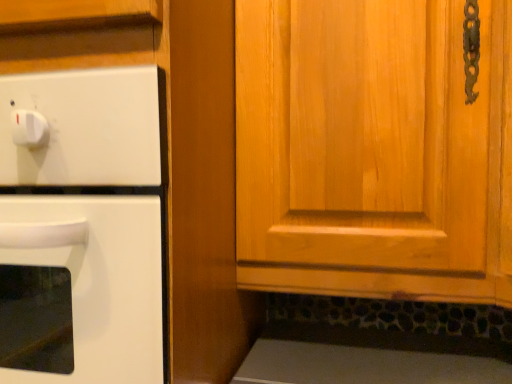
The height and width of the screenshot is (384, 512). Identify the location of white glossy oven at left. (81, 227).

Measure the distance between white glossy oven at left and camera.

white glossy oven at left is 17.34 inches away from camera.

Describe the element at coordinates (81, 227) in the screenshot. I see `white glossy oven at left` at that location.

Image resolution: width=512 pixels, height=384 pixels. I want to click on wooden cabinet at center, so click(373, 150).

Image resolution: width=512 pixels, height=384 pixels. Describe the element at coordinates (373, 150) in the screenshot. I see `wooden cabinet at center` at that location.

This screenshot has width=512, height=384. Identify the location of white glossy oven at left. (81, 227).

Does wooden cabinet at center appear on the left side of white glossy oven at left?

In fact, wooden cabinet at center is to the right of white glossy oven at left.

Does wooden cabinet at center lie behind white glossy oven at left?

No, wooden cabinet at center is closer to the camera.

Does point (510, 3) come farther from viewer compared to point (91, 275)?

Yes.

From the image's perspective, which object appears higher, wooden cabinet at center or white glossy oven at left?

wooden cabinet at center, from the image's perspective.

From a real-world perspective, between wooden cabinet at center and white glossy oven at left, who is vertically lower?

From a 3D spatial view, white glossy oven at left is below.

Considering the sizes of objects wooden cabinet at center and white glossy oven at left in the image provided, who is wider, wooden cabinet at center or white glossy oven at left?

wooden cabinet at center is wider.

Is wooden cabinet at center shorter than white glossy oven at left?

Yes, wooden cabinet at center is shorter than white glossy oven at left.

Considering the relative sizes of wooden cabinet at center and white glossy oven at left in the image provided, is wooden cabinet at center bigger than white glossy oven at left?

Yes, wooden cabinet at center is bigger than white glossy oven at left.

Would you say wooden cabinet at center is outside white glossy oven at left?

wooden cabinet at center lies outside white glossy oven at left's area.

Is wooden cabinet at center far away from white glossy oven at left?

wooden cabinet at center is near white glossy oven at left, not far away.

Could you tell me if wooden cabinet at center is turned towards white glossy oven at left?

No, wooden cabinet at center is not oriented towards white glossy oven at left.

How many degrees apart are the facing directions of wooden cabinet at center and white glossy oven at left?

They differ by 0.000762 degrees in their facing directions.

Locate an element on the screen. This screenshot has width=512, height=384. oven below the wooden cabinet at center (from a real-world perspective) is located at coordinates 81,227.

Can you confirm if white glossy oven at left is positioned to the left of wooden cabinet at center?

Correct, you'll find white glossy oven at left to the left of wooden cabinet at center.

In the scene shown: Which object is further away from the camera, white glossy oven at left or wooden cabinet at center?

Positioned behind is white glossy oven at left.

Is point (12, 358) positioned in front of point (380, 161)?

Yes, it is in front of point (380, 161).

From the image's perspective, is white glossy oven at left above or below wooden cabinet at center?

Clearly, from the image's perspective, white glossy oven at left is below wooden cabinet at center.

From a real-world perspective, is white glossy oven at left positioned under wooden cabinet at center based on gravity?

Yes.

Which of these two, white glossy oven at left or wooden cabinet at center, is wider?

wooden cabinet at center is wider.

Considering the relative sizes of white glossy oven at left and wooden cabinet at center in the image provided, is white glossy oven at left shorter than wooden cabinet at center?

Incorrect, the height of white glossy oven at left does not fall short of that of wooden cabinet at center.

Is white glossy oven at left smaller than wooden cabinet at center?

Indeed, white glossy oven at left has a smaller size compared to wooden cabinet at center.

Is wooden cabinet at center located within white glossy oven at left?

That's incorrect, wooden cabinet at center is not inside white glossy oven at left.

Would you say white glossy oven at left is a long distance from wooden cabinet at center?

No, white glossy oven at left is not far away from wooden cabinet at center.

Is white glossy oven at left facing away from wooden cabinet at center?

No.

How many degrees apart are the facing directions of white glossy oven at left and wooden cabinet at center?

0.000762 degrees separate the facing orientations of white glossy oven at left and wooden cabinet at center.

The height and width of the screenshot is (384, 512). I want to click on oven on the left of wooden cabinet at center, so click(x=81, y=227).

Locate an element on the screen. oven below the wooden cabinet at center (from the image's perspective) is located at coordinates (81, 227).

Identify the location of cabinetry lying on the right of white glossy oven at left. (373, 150).